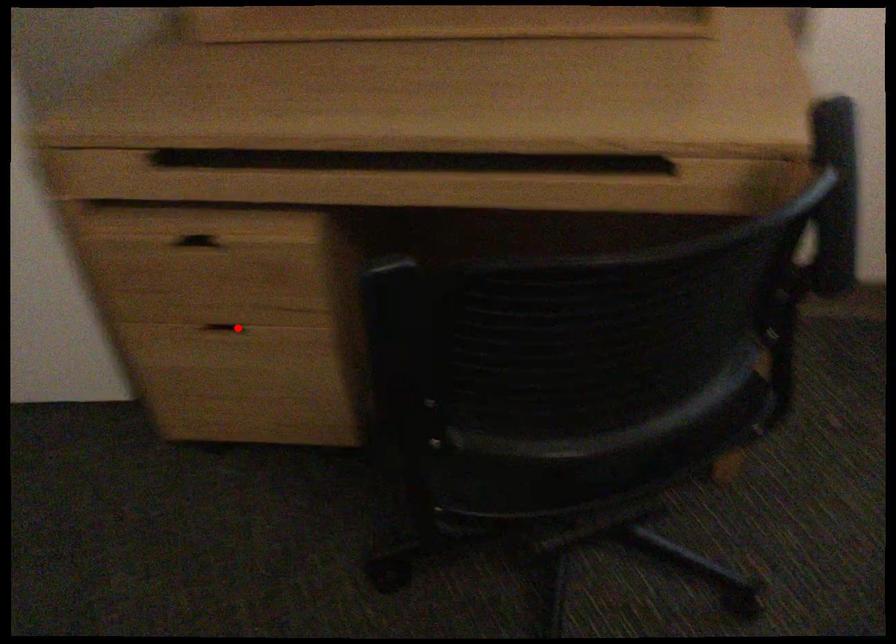
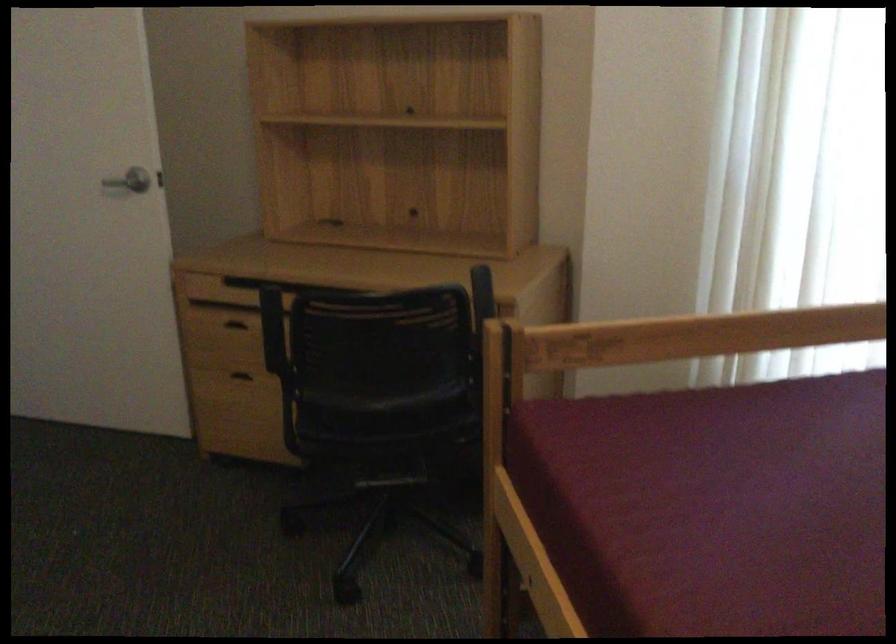
Question: A red point is marked in image1. In image2, is the corresponding 3D point closer to the camera or farther? Reply with the corresponding letter.

Choices:
 (A) The corresponding 3D point is closer.
 (B) The corresponding 3D point is farther.

Answer: (B)